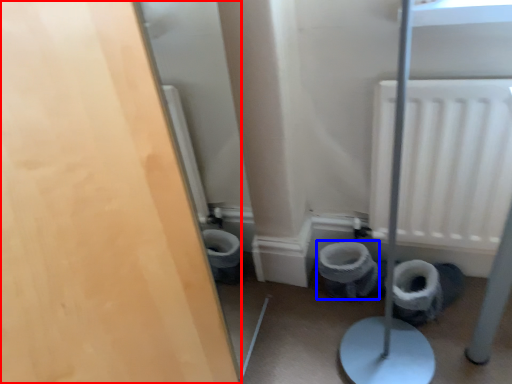
Question: Which object appears closest to the camera in this image, door (highlighted by a red box) or toilet bowl (highlighted by a blue box)?

Choices:
 (A) door
 (B) toilet bowl

Answer: (A)